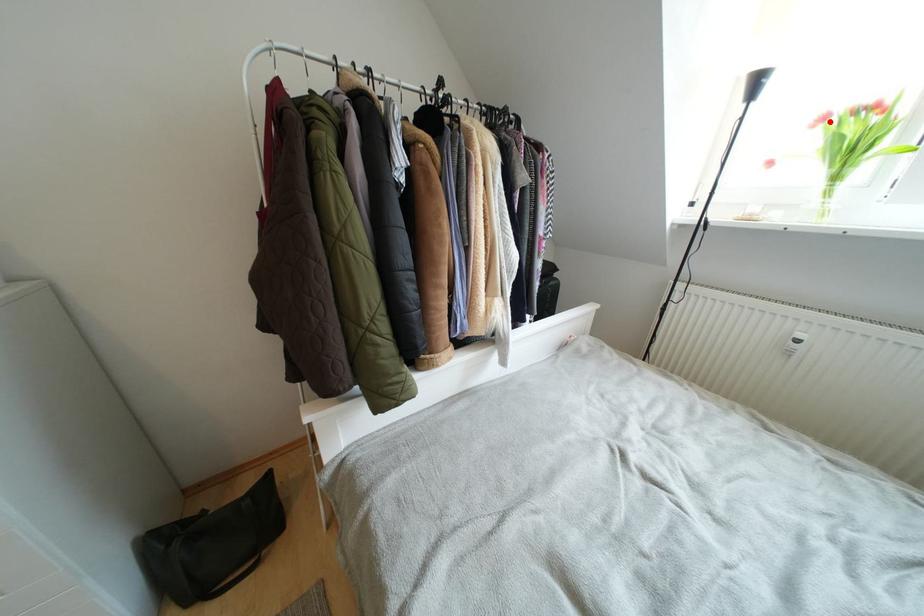
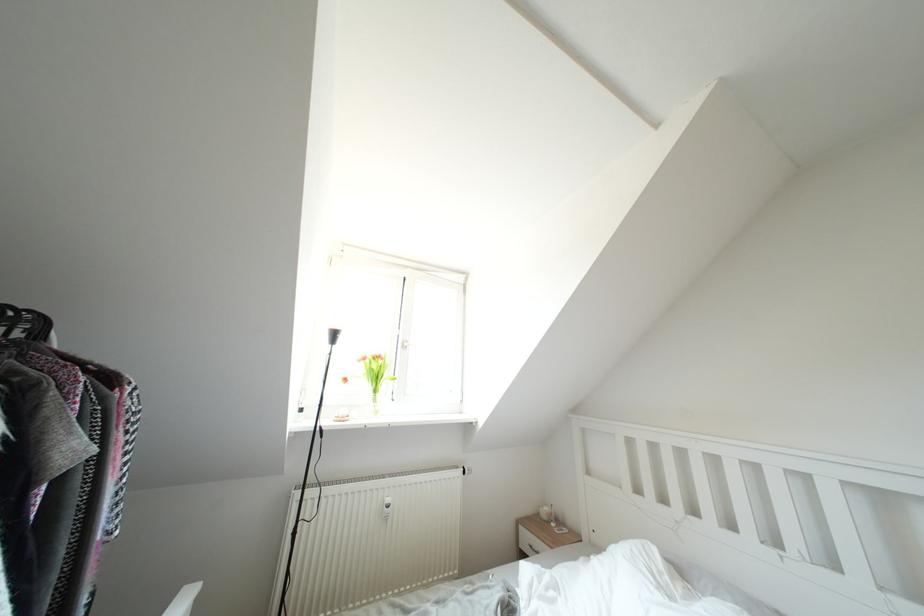
Find the pixel in the second image that matches the highlighted location in the first image.

(370, 363)